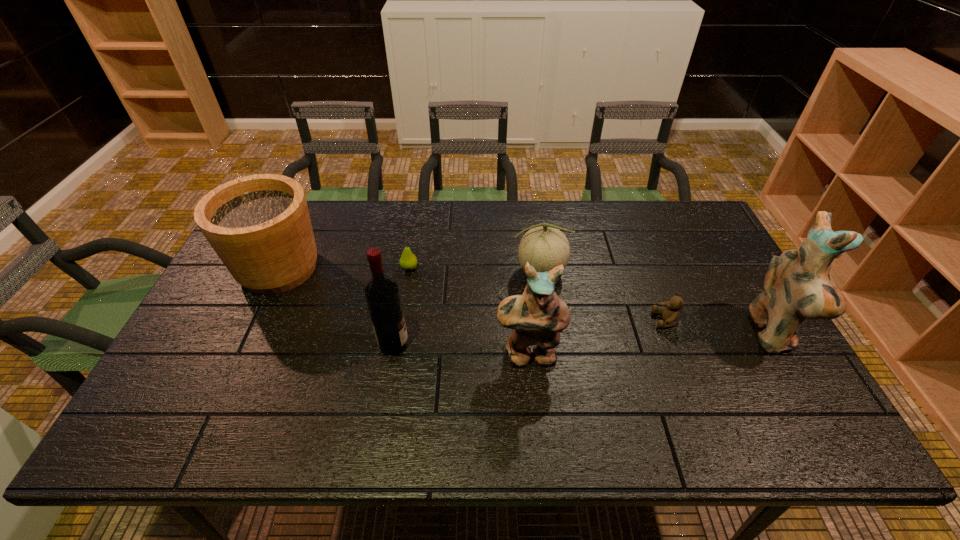
Locate an element on the screen. vacant space in between the left figurine and the alcohol is located at coordinates (461, 349).

Where is `vacant space that's between the taller figurine and the pear`? The height and width of the screenshot is (540, 960). vacant space that's between the taller figurine and the pear is located at coordinates (590, 301).

Point out which object is positioned as the third nearest to the rightmost object. Please provide its 2D coordinates. Your answer should be formatted as a tuple, i.e. [(x, y)], where the tuple contains the x and y coordinates of a point satisfying the conditions above.

[(536, 317)]

This screenshot has width=960, height=540. What are the coordinates of `the second closest object to the alcohol` in the screenshot? It's located at (536, 317).

Locate an element on the screen. Image resolution: width=960 pixels, height=540 pixels. free point that satisfies the following two spatial constraints: 1. on the front side of the third shortest object; 2. on the front and back of the alcohol is located at coordinates (549, 343).

Identify the location of free region that satisfies the following two spatial constraints: 1. on the front side of the pear; 2. on the front and back of the alcohol. (397, 343).

The width and height of the screenshot is (960, 540). In order to click on free space that satisfies the following two spatial constraints: 1. on the back side of the pear; 2. on the right side of the leftmost object in this screenshot , I will do `click(279, 268)`.